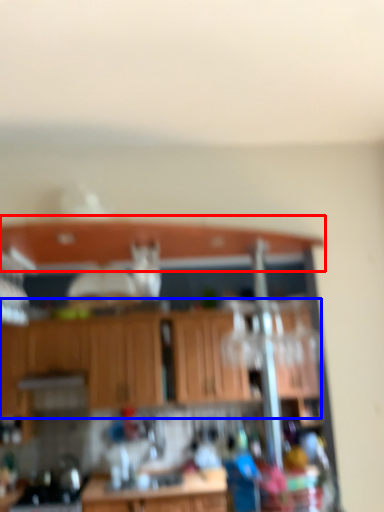
Question: Which object is closer to the camera taking this photo, window sill (highlighted by a red box) or cabinetry (highlighted by a blue box)?

Choices:
 (A) window sill
 (B) cabinetry

Answer: (A)